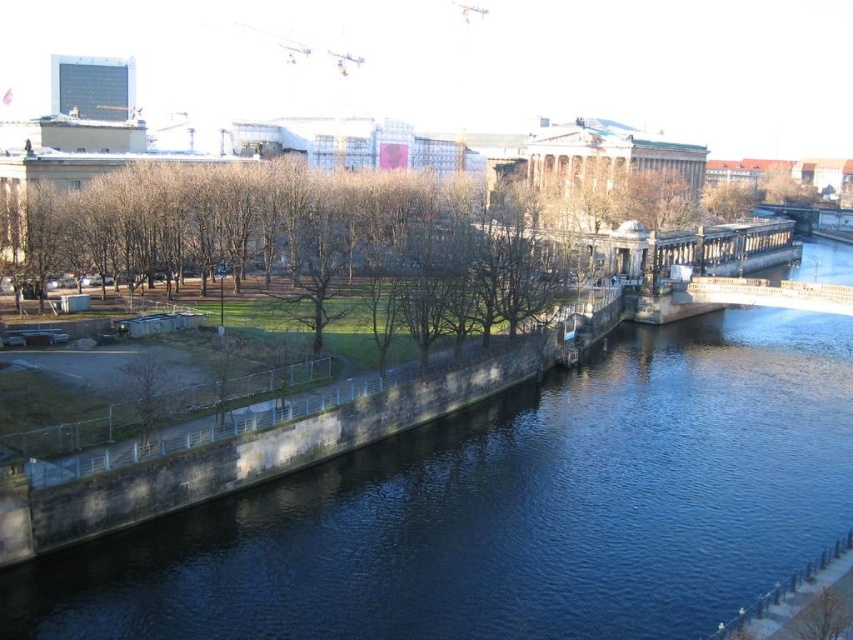
Question: Which point appears farthest from the camera in this image?

Choices:
 (A) (440, 490)
 (B) (724, 228)

Answer: (B)

Question: Which of the following is the closest to the observer?

Choices:
 (A) stone bridge at center
 (B) blue stone river at center

Answer: (B)

Question: Which point is closer to the camera?

Choices:
 (A) (283, 513)
 (B) (637, 248)

Answer: (A)

Question: Can you confirm if blue stone river at center is positioned to the right of stone bridge at center?

Choices:
 (A) no
 (B) yes

Answer: (A)

Question: Is blue stone river at center to the left of stone bridge at center from the viewer's perspective?

Choices:
 (A) no
 (B) yes

Answer: (B)

Question: Is blue stone river at center thinner than stone bridge at center?

Choices:
 (A) no
 (B) yes

Answer: (B)